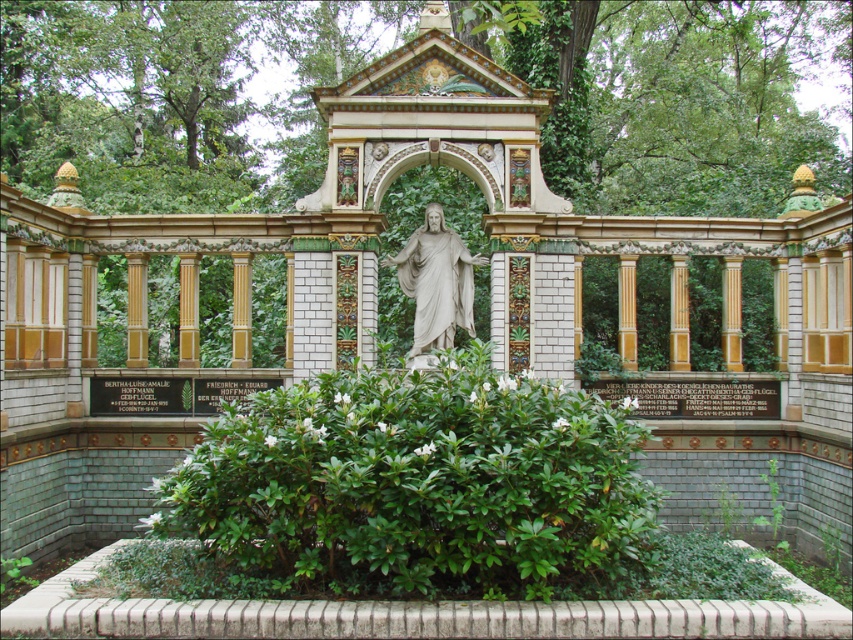
Question: Among these objects, which one is farthest from the camera?

Choices:
 (A) white marble statue at center
 (B) green leafy bush at center

Answer: (A)

Question: Can you confirm if green leafy bush at center is smaller than white marble statue at center?

Choices:
 (A) no
 (B) yes

Answer: (A)

Question: Which point is closer to the camera taking this photo?

Choices:
 (A) (303, 493)
 (B) (459, 300)

Answer: (A)

Question: Can you confirm if green leafy bush at center is positioned above white marble statue at center?

Choices:
 (A) yes
 (B) no

Answer: (B)

Question: Among these points, which one is nearest to the camera?

Choices:
 (A) (434, 317)
 (B) (360, 419)

Answer: (B)

Question: Can you confirm if green leafy bush at center is thinner than white marble statue at center?

Choices:
 (A) yes
 (B) no

Answer: (B)